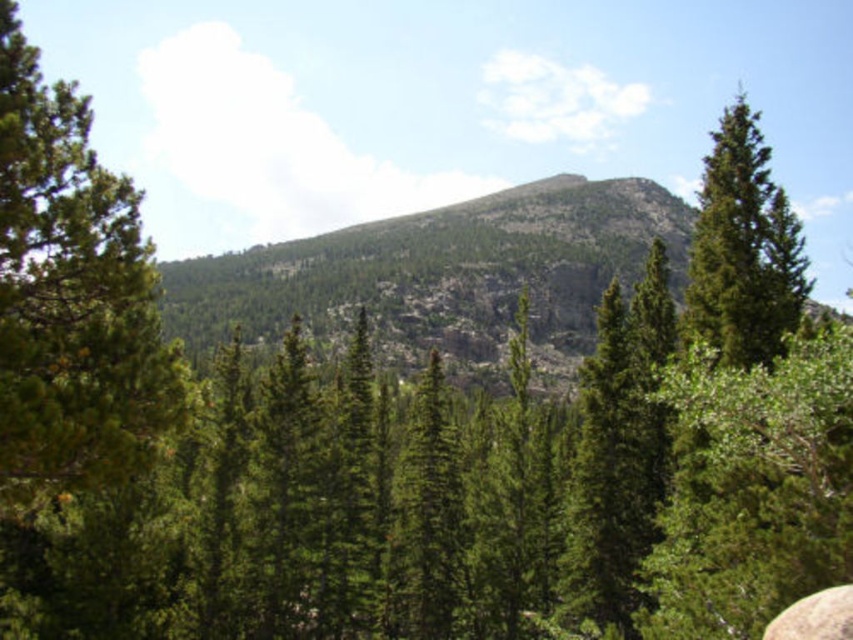
Between green matte tree at left and green matte tree at upper right, which one has less height?

green matte tree at left

Between green matte tree at left and green matte tree at upper right, which one appears on the left side from the viewer's perspective?

green matte tree at left

You are a GUI agent. You are given a task and a screenshot of the screen. Output one action in this format:
    pyautogui.click(x=<x>, y=<y>)
    Task: Click on the green matte tree at left
    The width and height of the screenshot is (853, 640).
    Given the screenshot: What is the action you would take?
    pyautogui.click(x=71, y=296)

Where is `green matte tree at left`? The height and width of the screenshot is (640, 853). green matte tree at left is located at coordinates (71, 296).

In the scene shown: Does green matte tree at left have a larger size compared to green matte tree at right?

No.

Between green matte tree at left and green matte tree at right, which one has more height?

With more height is green matte tree at right.

Identify the location of green matte tree at left. Image resolution: width=853 pixels, height=640 pixels. (71, 296).

Where is `green matte tree at left`? Image resolution: width=853 pixels, height=640 pixels. green matte tree at left is located at coordinates (71, 296).

Is point (700, 326) farther from viewer compared to point (778, 620)?

Yes, it is.

Who is lower down, green matte tree at upper right or gray rough stone at lower right?

gray rough stone at lower right is below.

Describe the element at coordinates (743, 248) in the screenshot. This screenshot has height=640, width=853. I see `green matte tree at upper right` at that location.

I want to click on green matte tree at upper right, so click(x=743, y=248).